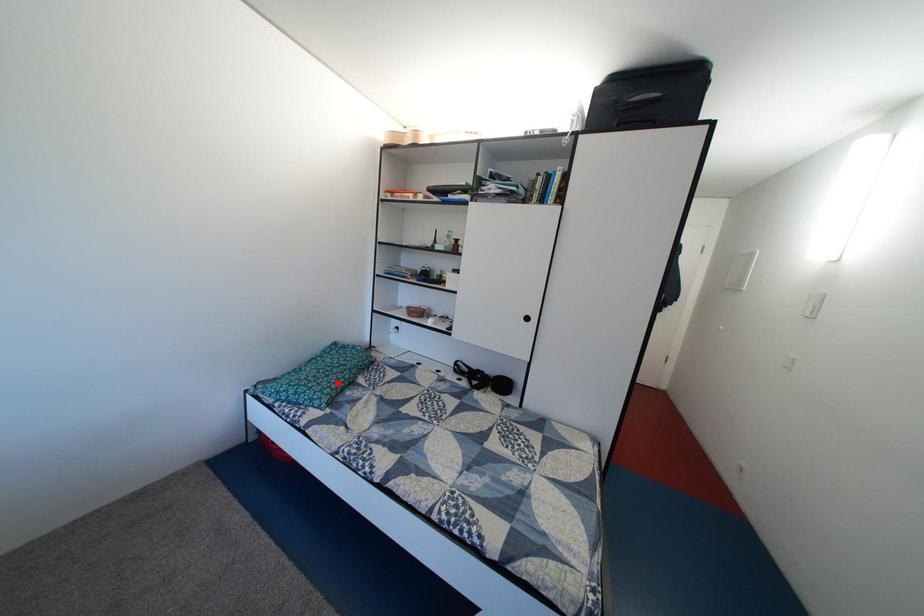
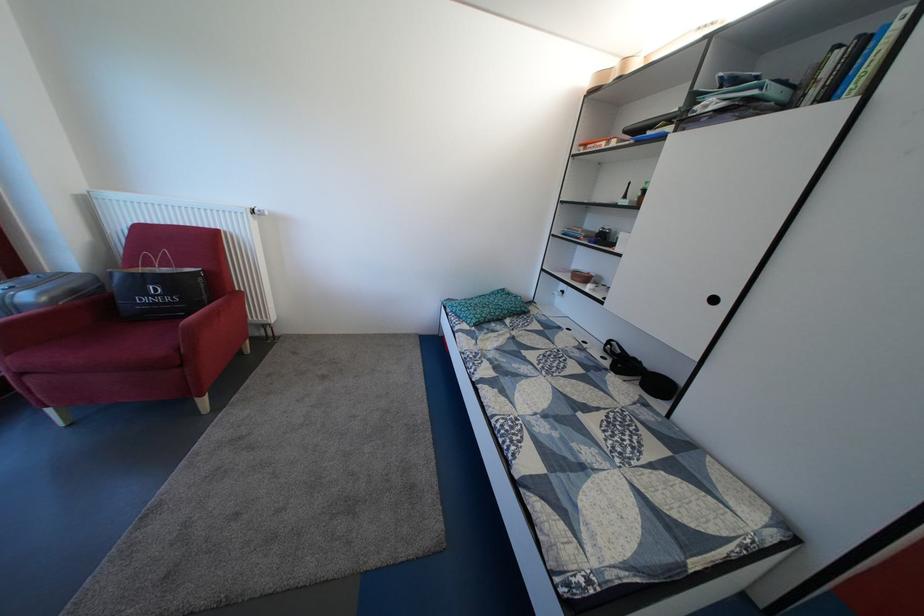
The point at the highlighted location is marked in the first image. Where is the corresponding point in the second image?

(494, 314)